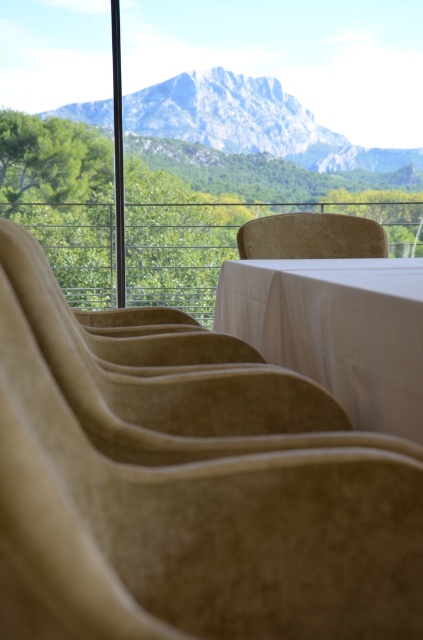
Question: Among these objects, which one is nearest to the camera?

Choices:
 (A) beige fabric chair at center
 (B) beige fabric armchair at center
 (C) transparent glass window at center
 (D) white clothed table at center

Answer: (B)

Question: Which point is farther to the camera?

Choices:
 (A) (331, 292)
 (B) (200, 232)
 (C) (214, 582)

Answer: (B)

Question: Is transparent glass window at center thinner than white clothed table at center?

Choices:
 (A) yes
 (B) no

Answer: (B)

Question: Is beige fabric armchair at center to the right of beige fabric chair at center from the viewer's perspective?

Choices:
 (A) no
 (B) yes

Answer: (A)

Question: Does white clothed table at center have a greater width compared to beige fabric chair at center?

Choices:
 (A) yes
 (B) no

Answer: (B)

Question: Among these objects, which one is farthest from the camera?

Choices:
 (A) transparent glass window at center
 (B) beige fabric armchair at center
 (C) white clothed table at center

Answer: (A)